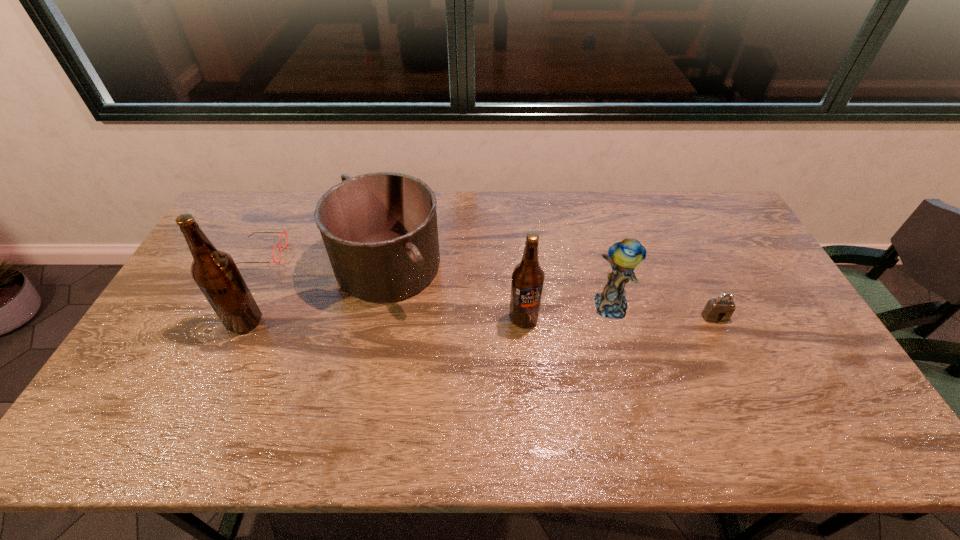
Please point a free position for a beer bottle on the right. Please provide its 2D coordinates. Your answer should be formatted as a tuple, i.e. [(x, y)], where the tuple contains the x and y coordinates of a point satisfying the conditions above.

[(800, 316)]